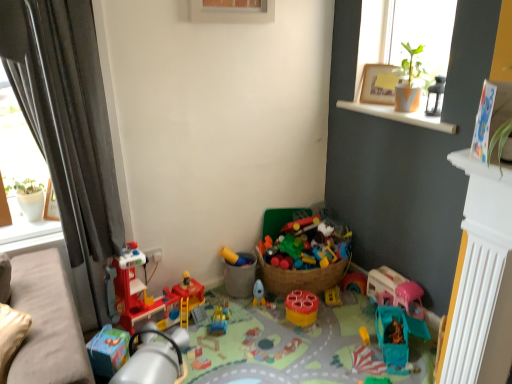
What are the coordinates of `vacant space situated above plastic construction set at center, placed as the 5th toy when sorted from left to right (from a real-world perspective)` in the screenshot? It's located at (274, 340).